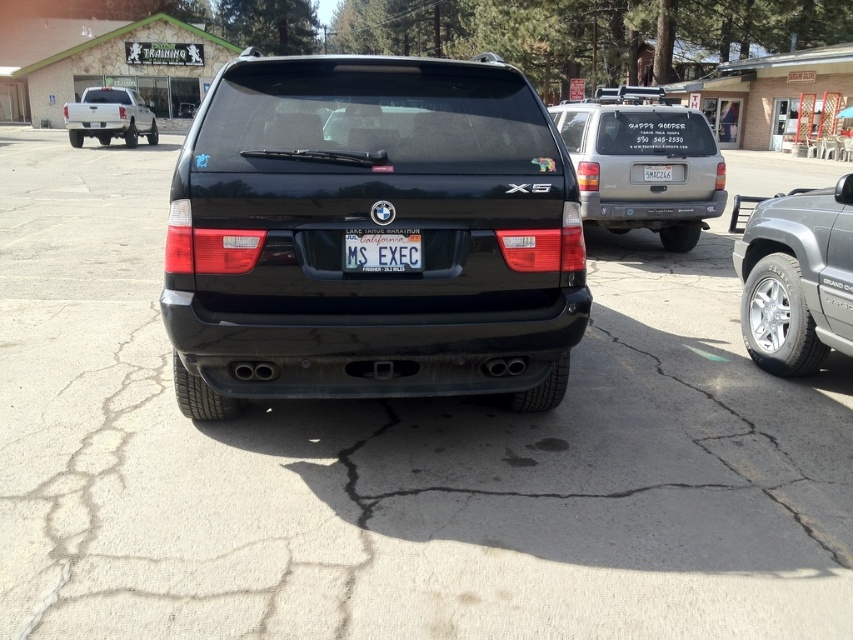
Question: Can you confirm if black matte suv at center is wider than metallic blue license plate at center?

Choices:
 (A) no
 (B) yes

Answer: (B)

Question: Which point appears farthest from the camera in this image?

Choices:
 (A) (384, 236)
 (B) (70, 122)

Answer: (B)

Question: Is black matte suv at center wider than white matte truck at upper left?

Choices:
 (A) no
 (B) yes

Answer: (A)

Question: Estimate the real-world distances between objects in this image. Which object is closer to the white matte truck at upper left?

Choices:
 (A) silver metallic truck at right
 (B) metallic blue license plate at center
 (C) black matte suv at center

Answer: (B)

Question: Which point is farther from the camera taking this photo?

Choices:
 (A) (810, 333)
 (B) (546, 234)
 (C) (96, 125)
 (D) (398, 248)

Answer: (C)

Question: Is silver metallic truck at right thinner than white matte truck at upper left?

Choices:
 (A) yes
 (B) no

Answer: (A)